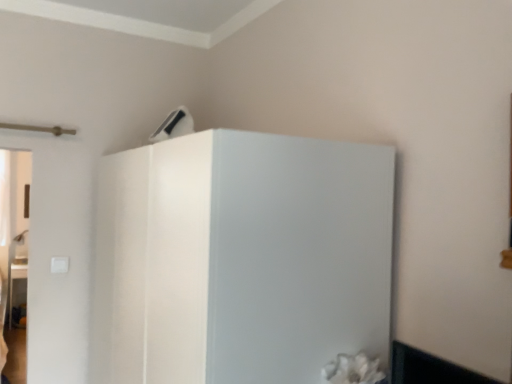
Question: In the image, is white glossy refrigerator at upper center on the left side or the right side of white plastic air conditioner at upper center?

Choices:
 (A) left
 (B) right

Answer: (B)

Question: Considering the positions of white glossy refrigerator at upper center and white plastic air conditioner at upper center in the image, is white glossy refrigerator at upper center wider or thinner than white plastic air conditioner at upper center?

Choices:
 (A) wide
 (B) thin

Answer: (A)

Question: Does point (293, 334) appear closer or farther from the camera than point (179, 109)?

Choices:
 (A) closer
 (B) farther

Answer: (A)

Question: From the image's perspective, is white plastic air conditioner at upper center positioned above or below white glossy refrigerator at upper center?

Choices:
 (A) above
 (B) below

Answer: (A)

Question: Relative to white glossy refrigerator at upper center, is white plastic air conditioner at upper center in front or behind?

Choices:
 (A) front
 (B) behind

Answer: (B)

Question: From a real-world perspective, is white plastic air conditioner at upper center positioned above or below white glossy refrigerator at upper center?

Choices:
 (A) below
 (B) above

Answer: (B)

Question: Looking at the image, does white plastic air conditioner at upper center seem bigger or smaller compared to white glossy refrigerator at upper center?

Choices:
 (A) big
 (B) small

Answer: (B)